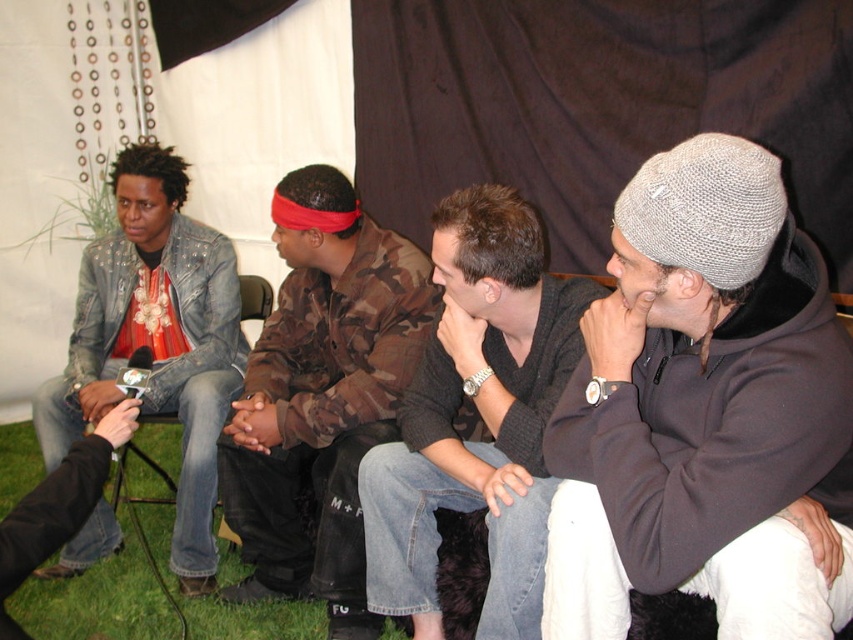
Who is lower down, camo-patterned jacket at center or denim jacket at left?

camo-patterned jacket at center is below.

Which is in front, point (293, 337) or point (184, 188)?

Point (293, 337) is more forward.

What do you see at coordinates (321, 397) in the screenshot? I see `camo-patterned jacket at center` at bounding box center [321, 397].

Locate an element on the screen. camo-patterned jacket at center is located at coordinates (321, 397).

Does knitted gray beanie at center have a larger size compared to dark gray knit beanie at center?

Incorrect, knitted gray beanie at center is not larger than dark gray knit beanie at center.

Does knitted gray beanie at center have a greater width compared to dark gray knit beanie at center?

No, knitted gray beanie at center is not wider than dark gray knit beanie at center.

Image resolution: width=853 pixels, height=640 pixels. What are the coordinates of `knitted gray beanie at center` in the screenshot? It's located at (703, 410).

Which is in front, point (784, 204) or point (225, 330)?

Point (784, 204)

Where is `knitted gray beanie at center`? knitted gray beanie at center is located at coordinates (703, 410).